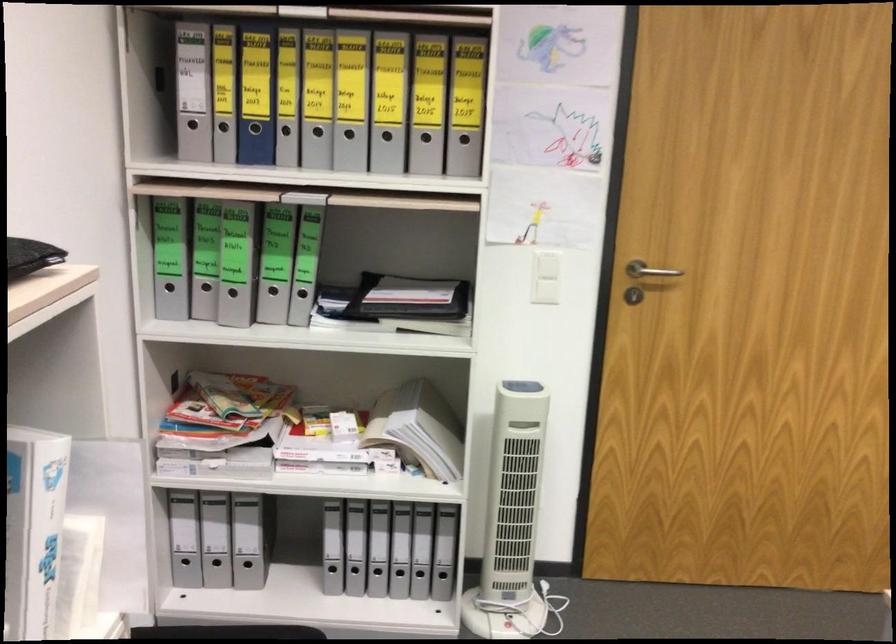
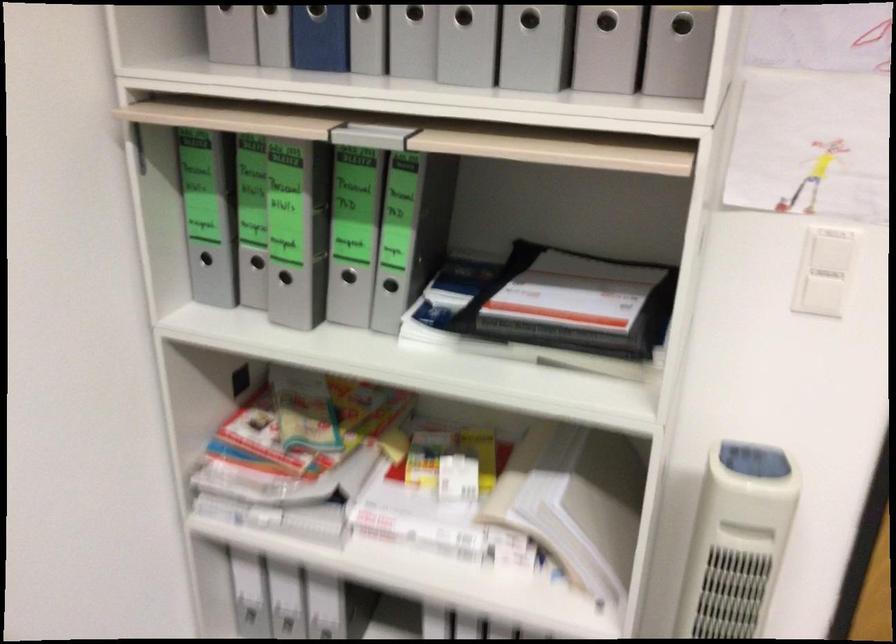
Find the pixel in the second image that matches the point at 300,296 in the first image.

(390, 285)